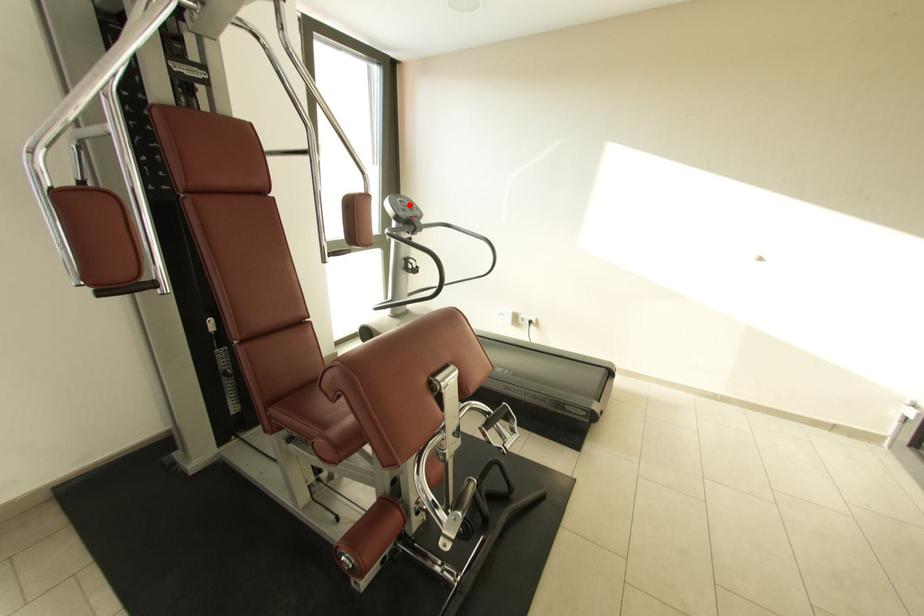
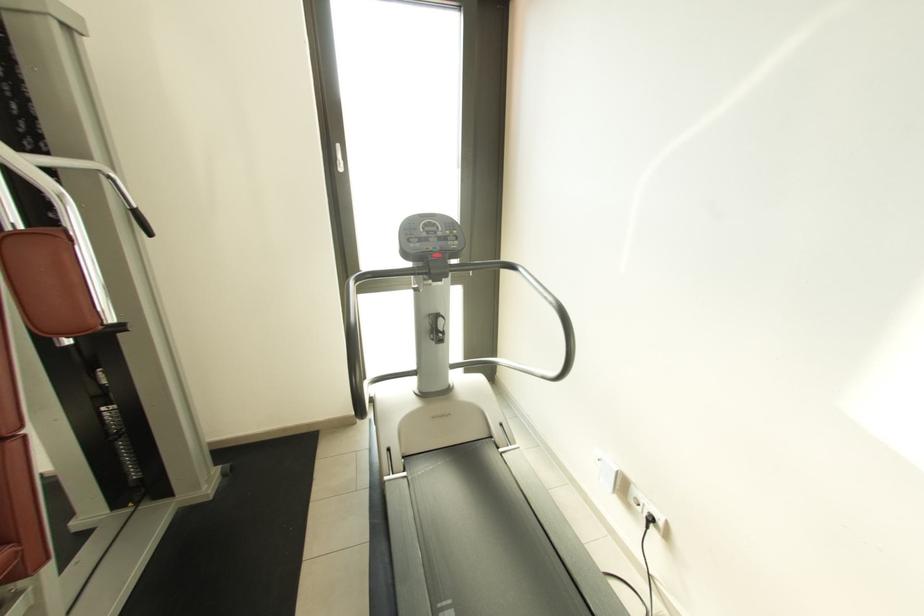
Locate, in the second image, the point that corresponds to the highlighted location in the first image.

(439, 230)